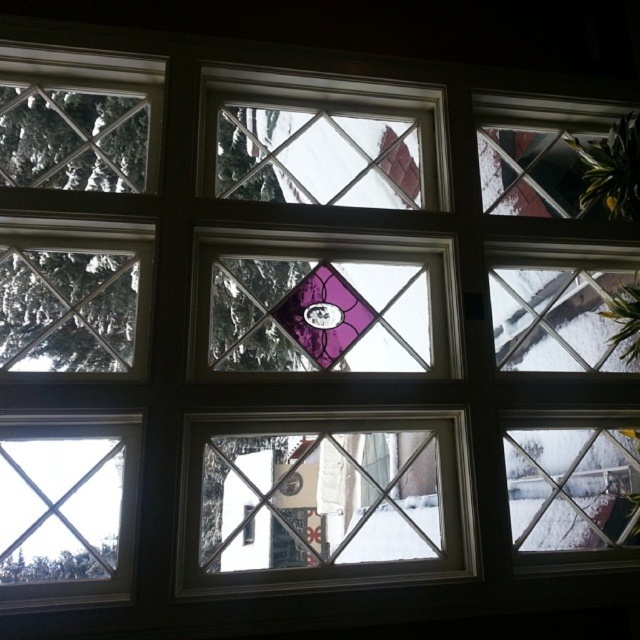
Is clear glass window frame at center bigger than clear glass window at lower left?

Correct, clear glass window frame at center is larger in size than clear glass window at lower left.

Who is higher up, clear glass window frame at center or clear glass window at lower left?

clear glass window at lower left is above.

What do you see at coordinates (323, 499) in the screenshot? I see `clear glass window frame at center` at bounding box center [323, 499].

Where is `clear glass window frame at center`? clear glass window frame at center is located at coordinates (323, 499).